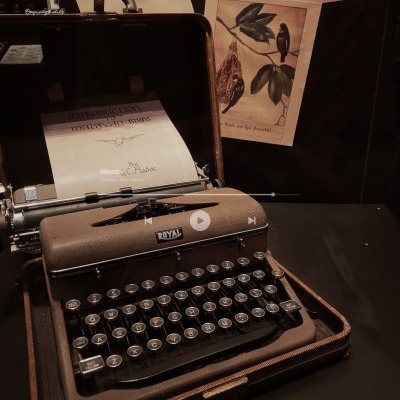
This screenshot has width=400, height=400. I want to click on paper in the typewriter, so coord(165,148).